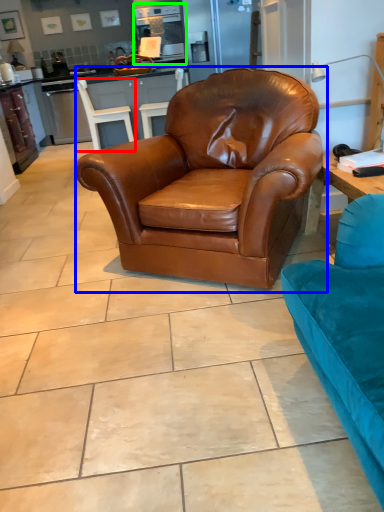
Question: Based on their relative distances, which object is farther from chair (highlighted by a red box)? Choose from chair (highlighted by a blue box) and appliance (highlighted by a green box).

Choices:
 (A) chair
 (B) appliance

Answer: (A)